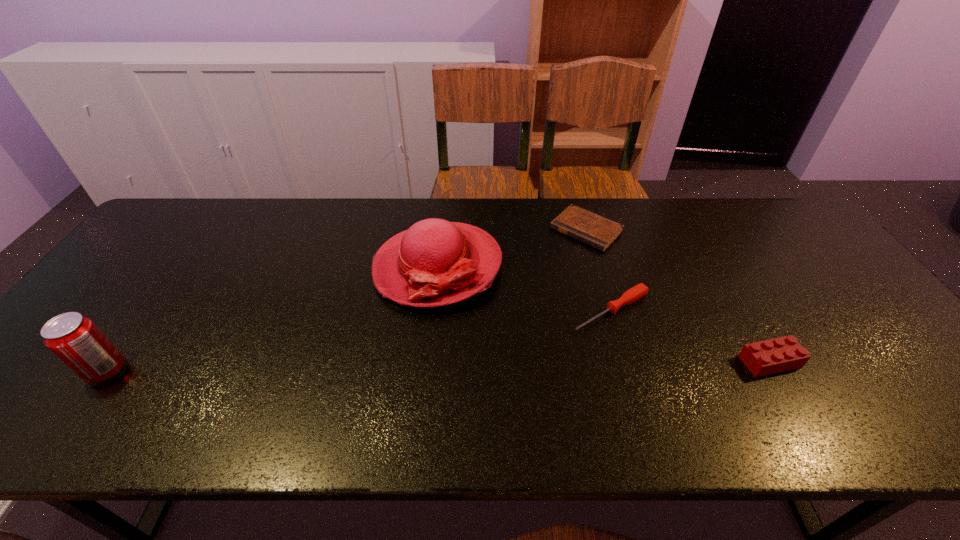
This screenshot has width=960, height=540. I want to click on vacant area that lies between the leftmost object and the rightmost object, so click(438, 366).

Find the location of a particular element. vacant point located between the shortest object and the fourth object from right to left is located at coordinates (512, 248).

Locate an element on the screen. The height and width of the screenshot is (540, 960). vacant space that's between the screwdriver and the second object from left to right is located at coordinates (524, 288).

You are a GUI agent. You are given a task and a screenshot of the screen. Output one action in this format:
    pyautogui.click(x=<x>, y=<y>)
    Task: Click on the free space that is in between the screwdriver and the hat
    The width and height of the screenshot is (960, 540).
    Given the screenshot: What is the action you would take?
    pyautogui.click(x=524, y=288)

Where is `free area in between the fourth tallest object and the Lego`? The height and width of the screenshot is (540, 960). free area in between the fourth tallest object and the Lego is located at coordinates (690, 336).

I want to click on free area in between the shortest object and the fourth tallest object, so click(599, 270).

Locate an element on the screen. free spot between the leftmost object and the screwdriver is located at coordinates (359, 341).

Locate an element on the screen. free space between the leftmost object and the screwdriver is located at coordinates (359, 341).

Find the location of a particular element. The image size is (960, 540). the third closest object to the shortest object is located at coordinates (762, 358).

Identify the location of the fourth closest object to the leftmost object. (762, 358).